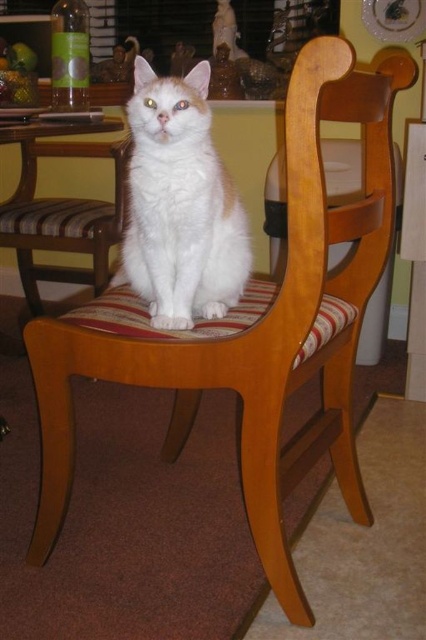
Question: Observing the image, what is the correct spatial positioning of white fluffy cat at center in reference to wooden chair at center?

Choices:
 (A) right
 (B) left

Answer: (A)

Question: In this image, where is white fluffy cat at center located relative to wooden chair at center?

Choices:
 (A) left
 (B) right

Answer: (B)

Question: Which point is closer to the camera?

Choices:
 (A) (20, 243)
 (B) (244, 248)

Answer: (B)

Question: Which point appears farthest from the camera in this image?

Choices:
 (A) (95, 205)
 (B) (235, 204)

Answer: (A)

Question: Is white fluffy cat at center positioned in front of wooden chair at center?

Choices:
 (A) no
 (B) yes

Answer: (B)